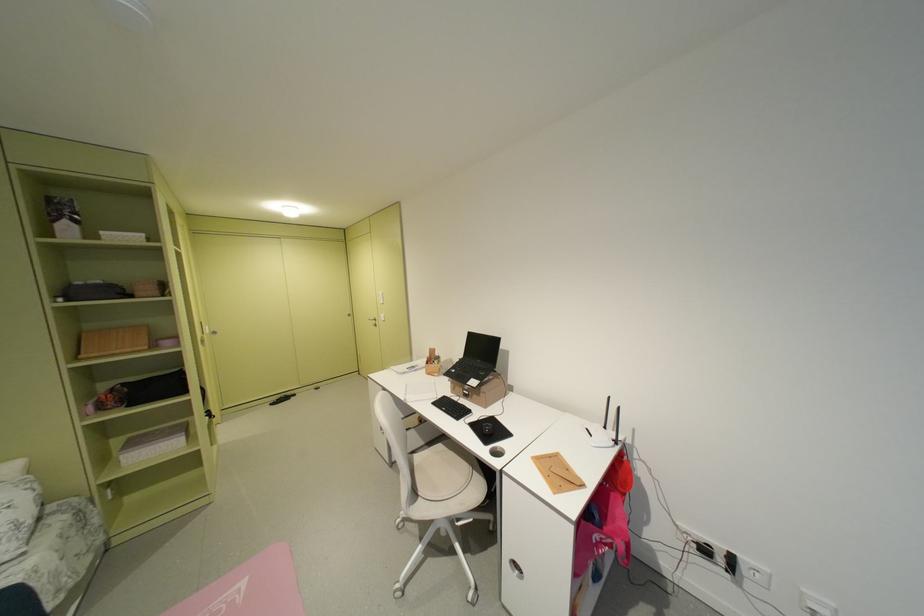
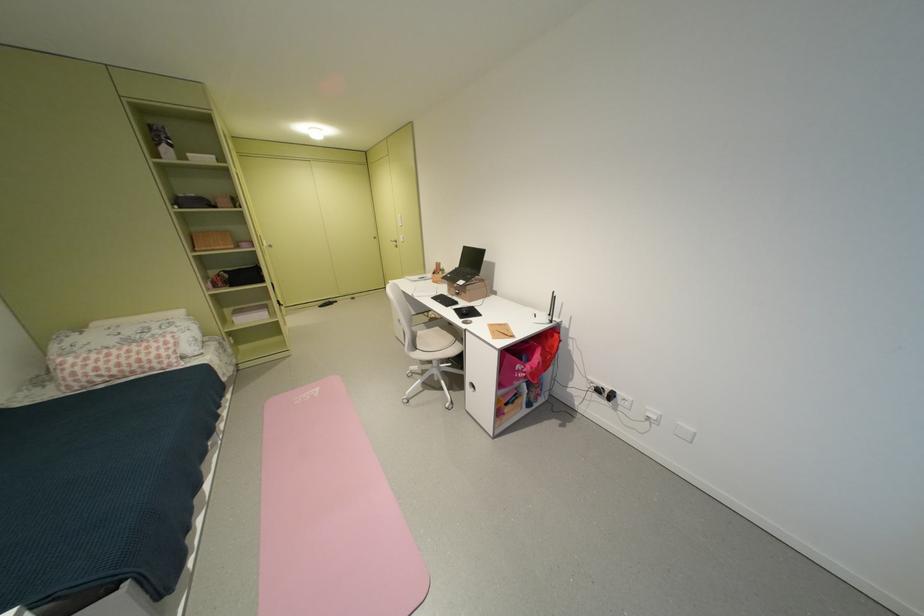
Locate, in the second image, the point that corresponds to point (597, 431) in the first image.

(544, 315)